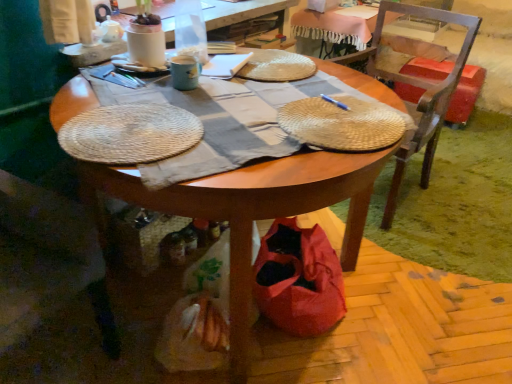
At what (x,y) coordinates should I click in order to perform the action: click on vacant area situated below woven straw placemat at center (from a real-world perspective). Please return your answer as a coordinate pair (x, y). This screenshot has height=384, width=512. Looking at the image, I should click on (342, 116).